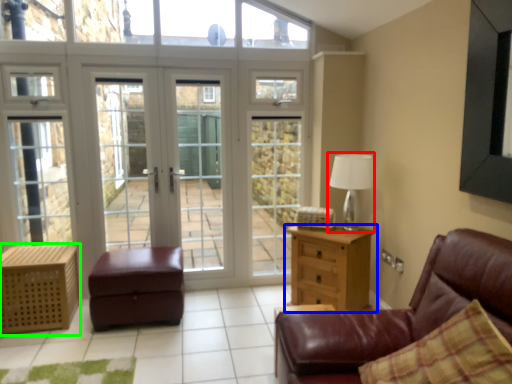
Question: Estimate the real-world distances between objects in this image. Which object is closer to table lamp (highlighted by a red box), chest of drawers (highlighted by a blue box) or nightstand (highlighted by a green box)?

Choices:
 (A) chest of drawers
 (B) nightstand

Answer: (A)